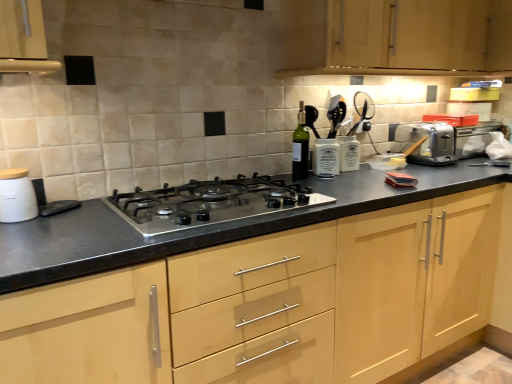
Question: Is silver metallic toaster at right located within light wood cabinet at center, the first cabinetry when ordered from bottom to top?

Choices:
 (A) no
 (B) yes

Answer: (A)

Question: Does light wood cabinet at center, the first cabinetry when ordered from bottom to top, have a lesser width compared to silver metallic toaster at right?

Choices:
 (A) no
 (B) yes

Answer: (A)

Question: Can you confirm if light wood cabinet at center, which is the second cabinetry in top-to-bottom order, is positioned to the left of silver metallic toaster at right?

Choices:
 (A) yes
 (B) no

Answer: (A)

Question: Is light wood cabinet at center, the first cabinetry when ordered from bottom to top, to the right of silver metallic toaster at right from the viewer's perspective?

Choices:
 (A) no
 (B) yes

Answer: (A)

Question: Is the depth of light wood cabinet at center, the first cabinetry when ordered from bottom to top, less than that of silver metallic toaster at right?

Choices:
 (A) no
 (B) yes

Answer: (B)

Question: Can you confirm if light wood cabinet at center, which is the second cabinetry in top-to-bottom order, is shorter than silver metallic toaster at right?

Choices:
 (A) no
 (B) yes

Answer: (A)

Question: Does white matte canister at left come behind light wood cabinet at center, which is the second cabinetry in top-to-bottom order?

Choices:
 (A) yes
 (B) no

Answer: (A)

Question: From the image's perspective, is white matte canister at left over light wood cabinet at center, which is the second cabinetry in top-to-bottom order?

Choices:
 (A) no
 (B) yes

Answer: (B)

Question: Does white matte canister at left have a greater width compared to light wood cabinet at center, the first cabinetry when ordered from bottom to top?

Choices:
 (A) no
 (B) yes

Answer: (A)

Question: From the image's perspective, is white matte canister at left under light wood cabinet at center, the first cabinetry when ordered from bottom to top?

Choices:
 (A) no
 (B) yes

Answer: (A)

Question: Would you say white matte canister at left is outside light wood cabinet at center, the first cabinetry when ordered from bottom to top?

Choices:
 (A) no
 (B) yes

Answer: (B)

Question: From a real-world perspective, is white matte canister at left below light wood cabinet at center, which is the second cabinetry in top-to-bottom order?

Choices:
 (A) yes
 (B) no

Answer: (B)

Question: Is green glass bottle at center outside light wood cabinet at upper center, which is the 2th cabinetry from bottom to top?

Choices:
 (A) no
 (B) yes

Answer: (B)